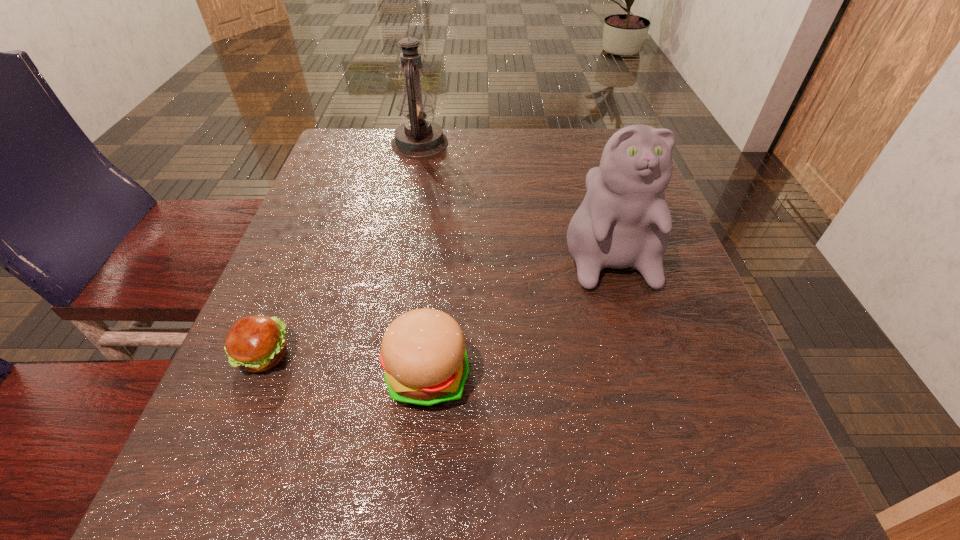
Where is `oil lamp`? Image resolution: width=960 pixels, height=540 pixels. oil lamp is located at coordinates (417, 138).

Locate an element on the screen. This screenshot has height=540, width=960. the third nearest object is located at coordinates (624, 221).

This screenshot has height=540, width=960. In order to click on cat in this screenshot , I will do `click(624, 221)`.

Identify the location of the right hamburger. This screenshot has width=960, height=540. (423, 352).

Locate an element on the screen. Image resolution: width=960 pixels, height=540 pixels. the taller hamburger is located at coordinates (423, 352).

The width and height of the screenshot is (960, 540). Find the location of `the left hamburger`. the left hamburger is located at coordinates (255, 343).

Locate an element on the screen. the leftmost object is located at coordinates (255, 343).

Image resolution: width=960 pixels, height=540 pixels. In order to click on vacant space located 0.280m on the right of the farthest object in this screenshot , I will do `click(555, 143)`.

At what (x,y) coordinates should I click in order to perform the action: click on vacant point located 0.340m on the face of the rightmost object. Please return your answer as a coordinate pair (x, y). This screenshot has width=960, height=540. Looking at the image, I should click on (684, 493).

Identify the location of free region located 0.090m on the right of the taller hamburger. The image size is (960, 540). (529, 376).